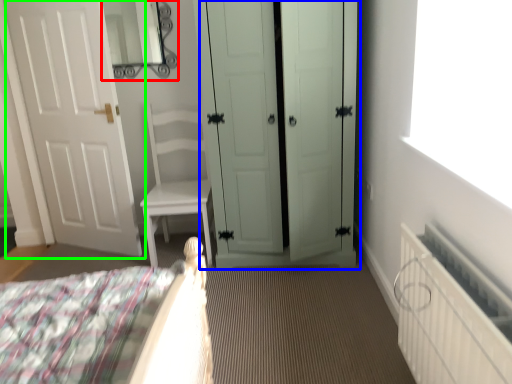
Question: Which is farther away from mirror (highlighted by a red box)? door (highlighted by a blue box) or door (highlighted by a green box)?

Choices:
 (A) door
 (B) door

Answer: (A)